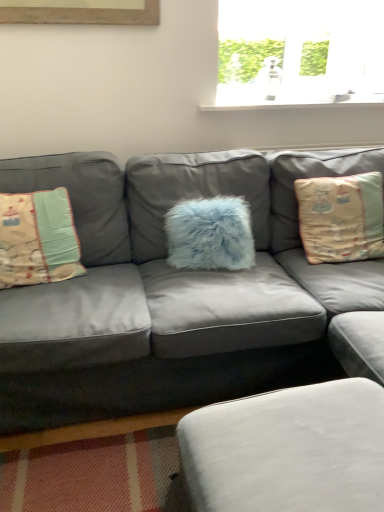
Image resolution: width=384 pixels, height=512 pixels. What do you see at coordinates (38, 239) in the screenshot? I see `beige fabric pillow at left, the first pillow in the left-to-right sequence` at bounding box center [38, 239].

What do you see at coordinates (288, 450) in the screenshot? The width and height of the screenshot is (384, 512). I see `white fabric footrest at lower center` at bounding box center [288, 450].

I want to click on beige fabric pillow at left, the first pillow in the left-to-right sequence, so click(38, 239).

Is matte gray couch at center positioned with its back to fluffy blue pillow at center, which is the second pillow in left-to-right order?

Absolutely, matte gray couch at center is directed away from fluffy blue pillow at center, which is the second pillow in left-to-right order.

Which of these two, matte gray couch at center or fluffy blue pillow at center, which is the second pillow in left-to-right order, is bigger?

With larger size is matte gray couch at center.

Can you confirm if matte gray couch at center is shorter than fluffy blue pillow at center, which is the second pillow in left-to-right order?

No.

From the image's perspective, which object appears higher, matte gray couch at center or fluffy blue pillow at center, the second pillow viewed from the right?

fluffy blue pillow at center, the second pillow viewed from the right, from the image's perspective.

From the image's perspective, which one is positioned lower, matte gray couch at center or beige fabric pillow at right, the first pillow positioned from the right?

matte gray couch at center, from the image's perspective.

Who is more distant, matte gray couch at center or beige fabric pillow at right, the first pillow positioned from the right?

beige fabric pillow at right, the first pillow positioned from the right, is further away from the camera.

Is matte gray couch at center facing away from beige fabric pillow at right, the first pillow positioned from the right?

Yes, matte gray couch at center is positioned with its back facing beige fabric pillow at right, the first pillow positioned from the right.

Would you say matte gray couch at center is outside beige fabric pillow at right, arranged as the 3th pillow when viewed from the left?

matte gray couch at center is positioned outside beige fabric pillow at right, arranged as the 3th pillow when viewed from the left.

Is beige fabric pillow at right, arranged as the 3th pillow when viewed from the left, bigger or smaller than fluffy blue pillow at center, which is the second pillow in left-to-right order?

Considering their sizes, beige fabric pillow at right, arranged as the 3th pillow when viewed from the left, takes up more space than fluffy blue pillow at center, which is the second pillow in left-to-right order.

Does point (305, 188) come closer to viewer compared to point (223, 242)?

That is False.

From the image's perspective, between beige fabric pillow at right, arranged as the 3th pillow when viewed from the left, and fluffy blue pillow at center, the second pillow viewed from the right, who is located below?

From the image's view, fluffy blue pillow at center, the second pillow viewed from the right, is below.

Locate an element on the screen. pillow that is on the right side of fluffy blue pillow at center, which is the second pillow in left-to-right order is located at coordinates (341, 217).

Choose the correct answer: Is beige fabric pillow at right, arranged as the 3th pillow when viewed from the left, inside white fabric footrest at lower center or outside it?

beige fabric pillow at right, arranged as the 3th pillow when viewed from the left, exists outside the volume of white fabric footrest at lower center.

Which object is further away from the camera, beige fabric pillow at right, arranged as the 3th pillow when viewed from the left, or white fabric footrest at lower center?

beige fabric pillow at right, arranged as the 3th pillow when viewed from the left, is behind.

Is point (343, 229) more distant than point (279, 472)?

Yes, it is behind point (279, 472).

From the image's perspective, is beige fabric pillow at right, arranged as the 3th pillow when viewed from the left, above or below white fabric footrest at lower center?

Based on their image positions, beige fabric pillow at right, arranged as the 3th pillow when viewed from the left, is located above white fabric footrest at lower center.

Does beige fabric pillow at left, the first pillow in the left-to-right sequence, have a greater height compared to fluffy blue pillow at center, the second pillow viewed from the right?

Correct, beige fabric pillow at left, the first pillow in the left-to-right sequence, is much taller as fluffy blue pillow at center, the second pillow viewed from the right.

In the image, there is a fluffy blue pillow at center, which is the second pillow in left-to-right order. What are the coordinates of `pillow below it (from the image's perspective)` in the screenshot? It's located at [x=38, y=239].

Is point (58, 248) more distant than point (181, 207)?

No, it is not.

Does fluffy blue pillow at center, which is the second pillow in left-to-right order, have a greater height compared to matte gray couch at center?

Incorrect, the height of fluffy blue pillow at center, which is the second pillow in left-to-right order, is not larger of that of matte gray couch at center.

From a real-world perspective, between fluffy blue pillow at center, which is the second pillow in left-to-right order, and matte gray couch at center, who is vertically lower?

From a 3D spatial view, matte gray couch at center is below.

Does fluffy blue pillow at center, which is the second pillow in left-to-right order, have a lesser width compared to matte gray couch at center?

Yes.

Is beige fabric pillow at right, the first pillow positioned from the right, located within beige fabric pillow at left, the 3th pillow positioned from the right?

That's incorrect, beige fabric pillow at right, the first pillow positioned from the right, is not inside beige fabric pillow at left, the 3th pillow positioned from the right.

From the image's perspective, between beige fabric pillow at left, the first pillow in the left-to-right sequence, and beige fabric pillow at right, the first pillow positioned from the right, which one is located above?

beige fabric pillow at right, the first pillow positioned from the right, appears higher in the image.

Consider the image. Is the depth of beige fabric pillow at left, the 3th pillow positioned from the right, greater than that of beige fabric pillow at right, the first pillow positioned from the right?

No, the depth of beige fabric pillow at left, the 3th pillow positioned from the right, is less than that of beige fabric pillow at right, the first pillow positioned from the right.

Looking at their sizes, would you say beige fabric pillow at left, the first pillow in the left-to-right sequence, is wider or thinner than beige fabric pillow at right, arranged as the 3th pillow when viewed from the left?

beige fabric pillow at left, the first pillow in the left-to-right sequence, is thinner than beige fabric pillow at right, arranged as the 3th pillow when viewed from the left.

The image size is (384, 512). In order to click on studio couch in front of the fluffy blue pillow at center, the second pillow viewed from the right in this screenshot , I will do `click(173, 292)`.

At what (x,y) coordinates should I click in order to perform the action: click on the 3rd pillow above the matte gray couch at center (from the image's perspective). Please return your answer as a coordinate pair (x, y). Image resolution: width=384 pixels, height=512 pixels. Looking at the image, I should click on (341, 217).

Based on the photo, from the image, which object appears to be farther from matte gray couch at center, white fabric footrest at lower center or beige fabric pillow at left, the first pillow in the left-to-right sequence?

white fabric footrest at lower center is positioned further to the anchor matte gray couch at center.

Which object lies further to the anchor point fluffy blue pillow at center, which is the second pillow in left-to-right order, beige fabric pillow at right, arranged as the 3th pillow when viewed from the left, or beige fabric pillow at left, the first pillow in the left-to-right sequence?

Among the two, beige fabric pillow at left, the first pillow in the left-to-right sequence, is located further to fluffy blue pillow at center, which is the second pillow in left-to-right order.

Looking at the image, which one is located closer to fluffy blue pillow at center, which is the second pillow in left-to-right order, matte gray couch at center or beige fabric pillow at left, the first pillow in the left-to-right sequence?

matte gray couch at center is positioned closer to the anchor fluffy blue pillow at center, which is the second pillow in left-to-right order.

When comparing their distances from white fabric footrest at lower center, does beige fabric pillow at left, the 3th pillow positioned from the right, or beige fabric pillow at right, arranged as the 3th pillow when viewed from the left, seem closer?

beige fabric pillow at right, arranged as the 3th pillow when viewed from the left, is positioned closer to the anchor white fabric footrest at lower center.

Based on their spatial positions, is beige fabric pillow at right, arranged as the 3th pillow when viewed from the left, or fluffy blue pillow at center, which is the second pillow in left-to-right order, further from white fabric footrest at lower center?

beige fabric pillow at right, arranged as the 3th pillow when viewed from the left, is further to white fabric footrest at lower center.

When comparing their distances from beige fabric pillow at left, the first pillow in the left-to-right sequence, does white fabric footrest at lower center or fluffy blue pillow at center, which is the second pillow in left-to-right order, seem further?

The object further to beige fabric pillow at left, the first pillow in the left-to-right sequence, is white fabric footrest at lower center.

When comparing their distances from white fabric footrest at lower center, does matte gray couch at center or beige fabric pillow at left, the first pillow in the left-to-right sequence, seem closer?

matte gray couch at center is closer to white fabric footrest at lower center.

Consider the image. Estimate the real-world distances between objects in this image. Which object is closer to beige fabric pillow at right, arranged as the 3th pillow when viewed from the left, fluffy blue pillow at center, the second pillow viewed from the right, or beige fabric pillow at left, the first pillow in the left-to-right sequence?

fluffy blue pillow at center, the second pillow viewed from the right, is closer to beige fabric pillow at right, arranged as the 3th pillow when viewed from the left.

Where is `footrest between beige fabric pillow at left, the first pillow in the left-to-right sequence, and beige fabric pillow at right, the first pillow positioned from the right, in the horizontal direction`? The width and height of the screenshot is (384, 512). footrest between beige fabric pillow at left, the first pillow in the left-to-right sequence, and beige fabric pillow at right, the first pillow positioned from the right, in the horizontal direction is located at coordinates (288, 450).

Identify the location of pillow between beige fabric pillow at left, the 3th pillow positioned from the right, and white fabric footrest at lower center, in the horizontal direction. The image size is (384, 512). (210, 234).

Where is `studio couch located between white fabric footrest at lower center and fluffy blue pillow at center, which is the second pillow in left-to-right order, in the depth direction`? This screenshot has height=512, width=384. studio couch located between white fabric footrest at lower center and fluffy blue pillow at center, which is the second pillow in left-to-right order, in the depth direction is located at coordinates (173, 292).

You are a GUI agent. You are given a task and a screenshot of the screen. Output one action in this format:
    pyautogui.click(x=<x>, y=<y>)
    Task: Click on the pillow situated between beige fabric pillow at left, the 3th pillow positioned from the right, and beige fabric pillow at right, arranged as the 3th pillow when viewed from the left, from left to right
    
    Given the screenshot: What is the action you would take?
    pyautogui.click(x=210, y=234)